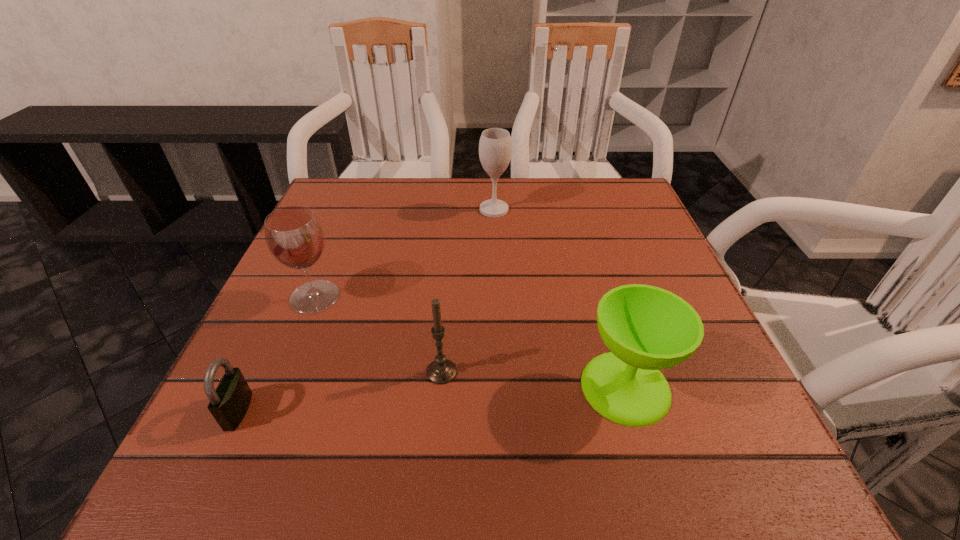
In order to click on free point located on the right of the third object from left to right in this screenshot , I will do `click(662, 372)`.

Locate an element on the screen. free space located 0.100m on the back of the rightmost object is located at coordinates (603, 312).

I want to click on vacant space located on the back of the padlock, so click(300, 276).

Identify the location of object located in the far edge section of the desktop. Image resolution: width=960 pixels, height=540 pixels. (495, 146).

Where is `object that is at the near edge`? Image resolution: width=960 pixels, height=540 pixels. object that is at the near edge is located at coordinates (229, 403).

Find the location of `wineglass at the left edge`. wineglass at the left edge is located at coordinates (294, 236).

The height and width of the screenshot is (540, 960). In order to click on padlock present at the left edge in this screenshot , I will do `click(229, 403)`.

This screenshot has width=960, height=540. Find the location of `object at the right edge`. object at the right edge is located at coordinates (646, 328).

Locate an element on the screen. The width and height of the screenshot is (960, 540). object that is at the near left corner is located at coordinates (229, 403).

Locate an element on the screen. vacant space at the far edge is located at coordinates (569, 181).